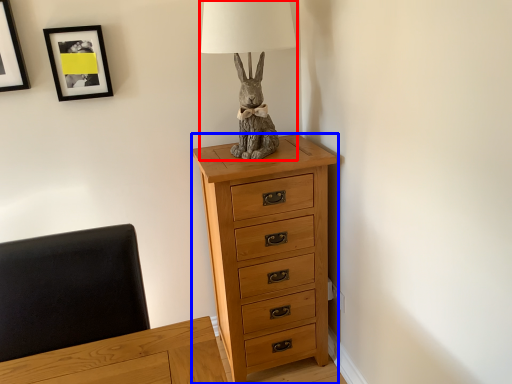
Question: Which of the following is the closest to the observer, table lamp (highlighted by a red box) or chest of drawers (highlighted by a blue box)?

Choices:
 (A) table lamp
 (B) chest of drawers

Answer: (A)